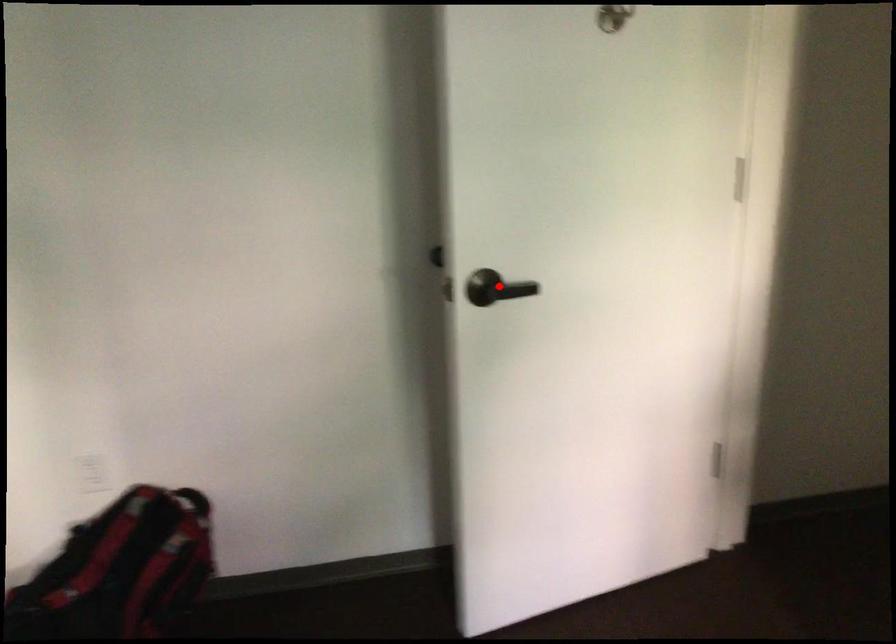
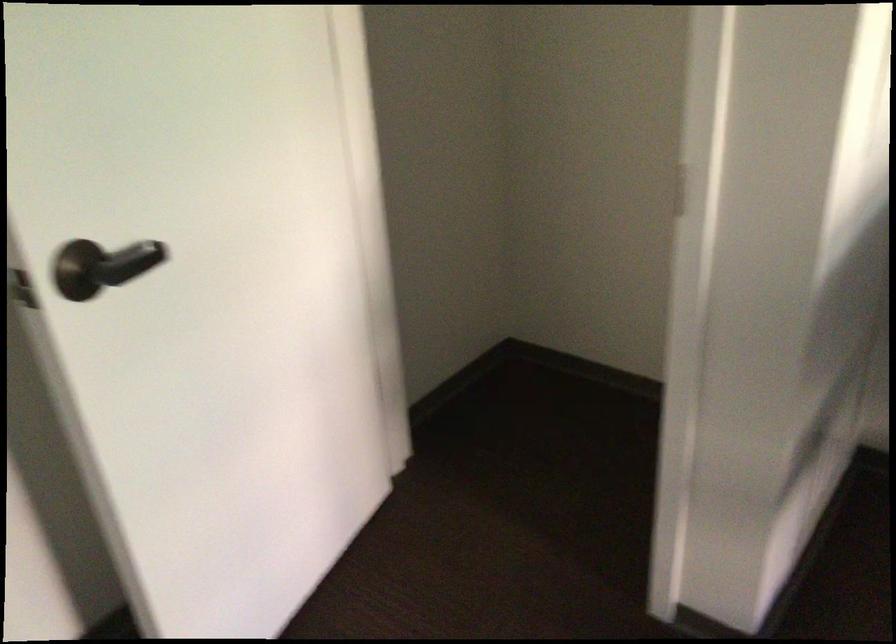
Locate, in the second image, the point that corresponds to the highlighted location in the first image.

(107, 265)